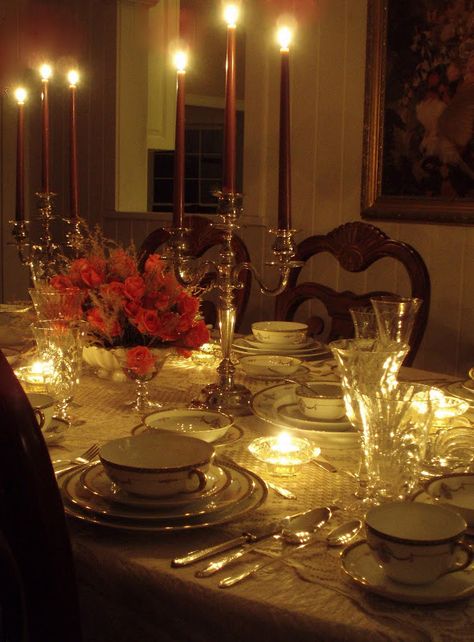
Find the location of a particular element. The width and height of the screenshot is (474, 642). red candles is located at coordinates (19, 168), (47, 162), (73, 160), (183, 173), (228, 171), (281, 165).